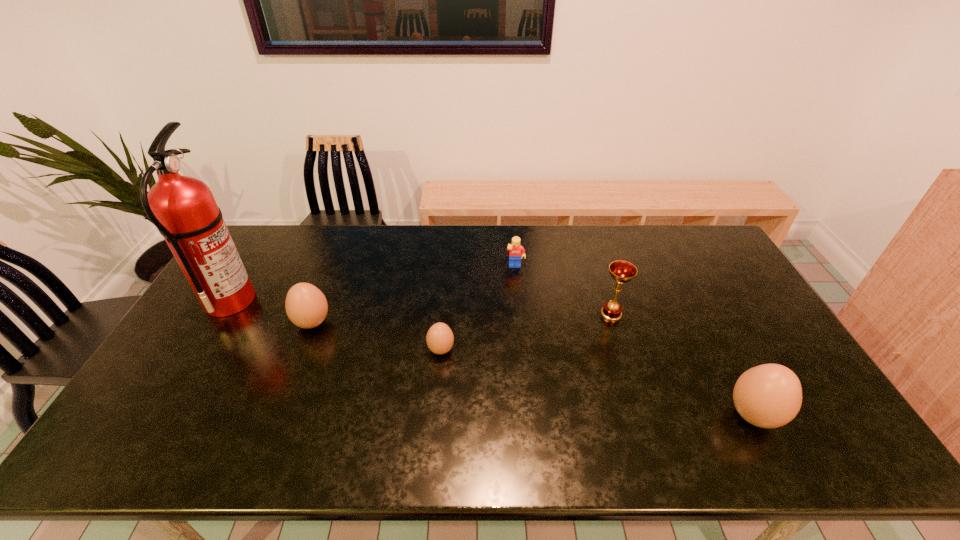
This screenshot has width=960, height=540. Find the location of `free space between the chalice and the tallest object`. free space between the chalice and the tallest object is located at coordinates (420, 307).

What are the coordinates of `unoccupied area between the rightmost object and the chalice` in the screenshot? It's located at (683, 364).

Identify the location of free space between the fire extinguisher and the shortest boiled egg. click(335, 325).

The height and width of the screenshot is (540, 960). Identify the location of vacant point located between the farthest boiled egg and the Lego. (414, 295).

At what (x,y) coordinates should I click in order to perform the action: click on blank region between the chalice and the nearest object. Please return your answer as a coordinate pair (x, y). The image size is (960, 540). Looking at the image, I should click on (683, 364).

Where is `vacant region between the nearest object and the shortest boiled egg`? Image resolution: width=960 pixels, height=540 pixels. vacant region between the nearest object and the shortest boiled egg is located at coordinates (597, 382).

Where is `free point between the second tallest boiled egg and the fire extinguisher`? free point between the second tallest boiled egg and the fire extinguisher is located at coordinates (271, 312).

You are a GUI agent. You are given a task and a screenshot of the screen. Output one action in this format:
    pyautogui.click(x=<x>, y=<y>)
    Task: Click on the free point between the second object from right to left and the rightmost boiled egg
    
    Given the screenshot: What is the action you would take?
    pyautogui.click(x=683, y=364)

Select which object is the fifth closest to the farthest object. Please provide its 2D coordinates. Your answer should be formatted as a tuple, i.e. [(x, y)], where the tuple contains the x and y coordinates of a point satisfying the conditions above.

[(183, 208)]

Choose which object is the second nearest neighbor to the fourth tallest object. Please provide its 2D coordinates. Your answer should be formatted as a tuple, i.e. [(x, y)], where the tuple contains the x and y coordinates of a point satisfying the conditions above.

[(439, 338)]